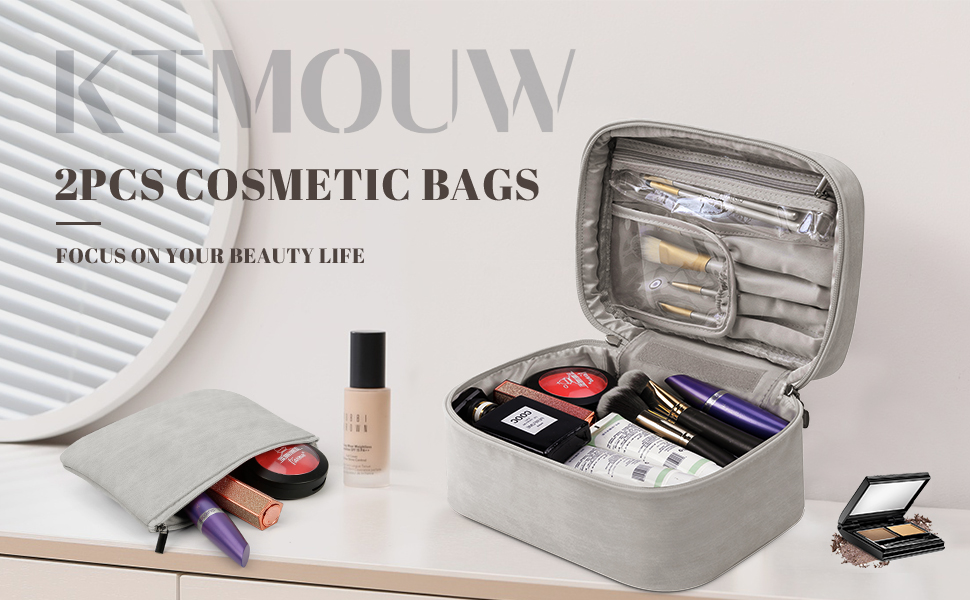
Identify the location of cosmetic case with some cosmetics outside on counter. (746, 308), (875, 539), (375, 436), (312, 471), (267, 502), (229, 520).